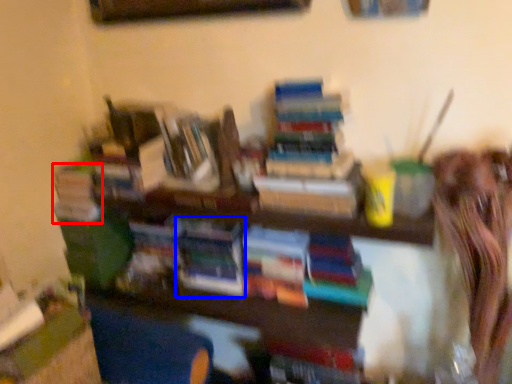
Question: Which object appears closest to the camera in this image, book (highlighted by a red box) or book (highlighted by a blue box)?

Choices:
 (A) book
 (B) book

Answer: (B)